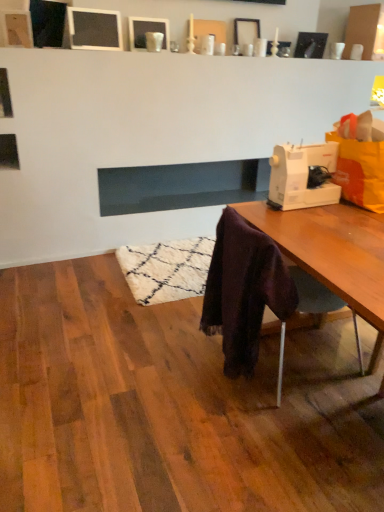
Question: Considering the positions of white plastic sewing machine at right and matte white picture frame at upper center, which is the 3th picture frame from right to left, in the image, is white plastic sewing machine at right wider or thinner than matte white picture frame at upper center, which is the 3th picture frame from right to left,?

Choices:
 (A) thin
 (B) wide

Answer: (B)

Question: From the image's perspective, is white plastic sewing machine at right above or below matte white picture frame at upper center, which is the 3th picture frame from right to left?

Choices:
 (A) above
 (B) below

Answer: (B)

Question: Which of these objects is positioned closest to the velvet purple scarf at lower right?

Choices:
 (A) matte white picture frame at upper center, which appears as the second picture frame when viewed from the left
 (B) matte black picture frame at upper right, which is the 1th picture frame from right to left
 (C) matte white picture frame at upper center, which appears as the second picture frame when viewed from the right
 (D) matte black picture frame at upper center, which appears as the 4th picture frame when viewed from the right
 (E) white plastic sewing machine at right

Answer: (E)

Question: Which object is positioned farthest from the matte white picture frame at upper center, which is the 3th picture frame from right to left?

Choices:
 (A) matte white picture frame at upper center, which appears as the second picture frame when viewed from the right
 (B) matte black picture frame at upper right, which is the 1th picture frame from right to left
 (C) white plastic sewing machine at right
 (D) dark glass fireplace at center
 (E) matte black picture frame at upper center, acting as the 1th picture frame starting from the left

Answer: (C)